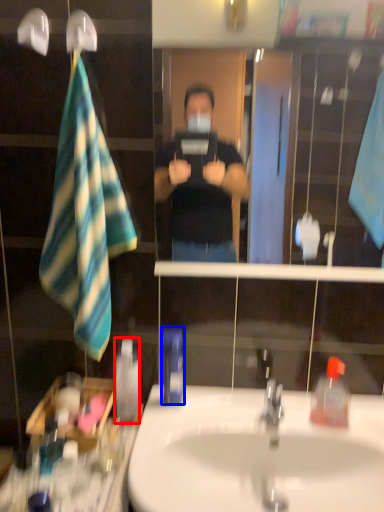
Question: Which of the following is the closest to the observer, mouthwash (highlighted by a red box) or mouthwash (highlighted by a blue box)?

Choices:
 (A) mouthwash
 (B) mouthwash

Answer: (B)